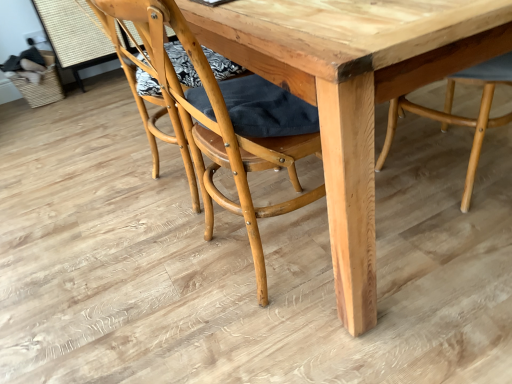
At what (x,y) coordinates should I click in order to perform the action: click on vacant area to the right of natural wood chair at center, the first chair when ordered from left to right. Please return your answer as a coordinate pair (x, y). Looking at the image, I should click on (428, 244).